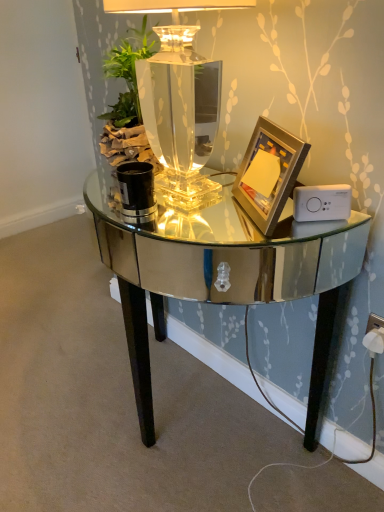
What do you see at coordinates (217, 271) in the screenshot?
I see `mirrored glass table at center` at bounding box center [217, 271].

What do you see at coordinates (176, 98) in the screenshot? I see `clear glass table lamp at center` at bounding box center [176, 98].

I want to click on gold metallic picture frame at right, so click(268, 173).

Locate an element on the screen. Image resolution: width=384 pixels, height=512 pixels. white plastic socket at lower right is located at coordinates (374, 334).

Locate an element on the screen. mirrored glass table at center is located at coordinates (217, 271).

From a real-world perspective, is mirrored glass table at center positioned above or below white plastic ipod at right?

From a real-world perspective, mirrored glass table at center is physically below white plastic ipod at right.

Would you say white plastic ipod at right is part of mirrored glass table at center's contents?

No, white plastic ipod at right is not inside mirrored glass table at center.

Locate an element on the screen. table below the white plastic ipod at right (from the image's perspective) is located at coordinates (217, 271).

Can you tell me how much mirrored glass table at center and white plastic socket at lower right differ in facing direction?

The facing directions of mirrored glass table at center and white plastic socket at lower right are 1.05 degrees apart.

In the scene shown: Would you say mirrored glass table at center is outside white plastic socket at lower right?

Absolutely, mirrored glass table at center is external to white plastic socket at lower right.

Is mirrored glass table at center positioned before white plastic socket at lower right?

Yes, it is.

Between mirrored glass table at center and white plastic socket at lower right, which one has less height?

white plastic socket at lower right is shorter.

From a real-world perspective, between mirrored glass table at center and clear glass table lamp at center, who is vertically higher?

clear glass table lamp at center, from a real-world perspective.

From the picture: Is the depth of mirrored glass table at center greater than that of clear glass table lamp at center?

No, mirrored glass table at center is in front of clear glass table lamp at center.

From the image's perspective, is mirrored glass table at center above or below clear glass table lamp at center?

mirrored glass table at center is below clear glass table lamp at center.

I want to click on electric outlet lying on the right of clear glass table lamp at center, so click(x=374, y=334).

Considering the relative sizes of white plastic socket at lower right and clear glass table lamp at center in the image provided, is white plastic socket at lower right taller than clear glass table lamp at center?

Incorrect, the height of white plastic socket at lower right is not larger of that of clear glass table lamp at center.

Which of these two, white plastic socket at lower right or clear glass table lamp at center, is smaller?

white plastic socket at lower right.

Would you say clear glass table lamp at center is inside or outside mirrored glass table at center?

clear glass table lamp at center is outside mirrored glass table at center.

Find the location of a particular element. The image size is (384, 512). table lamp lying on the right of mirrored glass table at center is located at coordinates (176, 98).

Can you confirm if clear glass table lamp at center is taller than mirrored glass table at center?

In fact, clear glass table lamp at center may be shorter than mirrored glass table at center.

Considering their positions, is clear glass table lamp at center located in front of or behind mirrored glass table at center?

In the image, clear glass table lamp at center appears behind mirrored glass table at center.

From the image's perspective, is white plastic socket at lower right under white plastic ipod at right?

Indeed, from the image's perspective, white plastic socket at lower right is shown beneath white plastic ipod at right.

Does point (370, 344) come behind point (319, 197)?

That is True.

What are the coordinates of `electric outlet on the right of white plastic ipod at right` in the screenshot? It's located at (374, 334).

Is white plastic socket at lower right positioned behind white plastic ipod at right?

Yes, it is behind white plastic ipod at right.

Based on the photo, is white plastic ipod at right in front of or behind clear glass table lamp at center in the image?

In the image, white plastic ipod at right appears behind clear glass table lamp at center.

Measure the distance between white plastic ipod at right and clear glass table lamp at center.

A distance of 47.57 centimeters exists between white plastic ipod at right and clear glass table lamp at center.

Can you confirm if white plastic ipod at right is smaller than clear glass table lamp at center?

Correct, white plastic ipod at right occupies less space than clear glass table lamp at center.

Where is `table that appears below the white plastic ipod at right (from the image's perspective)`? The width and height of the screenshot is (384, 512). table that appears below the white plastic ipod at right (from the image's perspective) is located at coordinates (217, 271).

The height and width of the screenshot is (512, 384). What are the coordinates of `electric outlet that appears above the mirrored glass table at center (from the image's perspective)` in the screenshot? It's located at (374, 334).

Estimate the real-world distances between objects in this image. Which object is further from mirrored glass table at center, clear glass table lamp at center or white plastic ipod at right?

Based on the image, white plastic ipod at right appears to be further to mirrored glass table at center.

Estimate the real-world distances between objects in this image. Which object is further from white plastic ipod at right, white plastic socket at lower right or gold metallic picture frame at right?

Based on the image, white plastic socket at lower right appears to be further to white plastic ipod at right.

Based on their spatial positions, is white plastic socket at lower right or gold metallic picture frame at right further from clear glass table lamp at center?

white plastic socket at lower right.

From the image, which object appears to be farther from clear glass table lamp at center, white plastic socket at lower right or white plastic ipod at right?

white plastic socket at lower right lies further to clear glass table lamp at center than the other object.

Which object lies nearer to the anchor point mirrored glass table at center, gold metallic picture frame at right or clear glass table lamp at center?

gold metallic picture frame at right lies closer to mirrored glass table at center than the other object.

Considering their positions, is gold metallic picture frame at right positioned further to clear glass table lamp at center than mirrored glass table at center?

mirrored glass table at center lies further to clear glass table lamp at center than the other object.

Estimate the real-world distances between objects in this image. Which object is closer to gold metallic picture frame at right, mirrored glass table at center or white plastic socket at lower right?

mirrored glass table at center is positioned closer to the anchor gold metallic picture frame at right.

Based on their spatial positions, is clear glass table lamp at center or gold metallic picture frame at right further from white plastic ipod at right?

clear glass table lamp at center lies further to white plastic ipod at right than the other object.

You are a GUI agent. You are given a task and a screenshot of the screen. Output one action in this format:
    pyautogui.click(x=<x>, y=<y>)
    Task: Click on the ipod situated between mirrored glass table at center and white plastic socket at lower right from left to right
    The image size is (384, 512).
    Given the screenshot: What is the action you would take?
    pyautogui.click(x=322, y=202)

At what (x,y) coordinates should I click in order to perform the action: click on picture frame between mirrored glass table at center and white plastic socket at lower right. Please return your answer as a coordinate pair (x, y). Image resolution: width=384 pixels, height=512 pixels. Looking at the image, I should click on (268, 173).

The height and width of the screenshot is (512, 384). What are the coordinates of `picture frame that lies between clear glass table lamp at center and white plastic socket at lower right from top to bottom` in the screenshot? It's located at (268, 173).

Find the location of a particular element. The height and width of the screenshot is (512, 384). ipod between gold metallic picture frame at right and white plastic socket at lower right vertically is located at coordinates (322, 202).